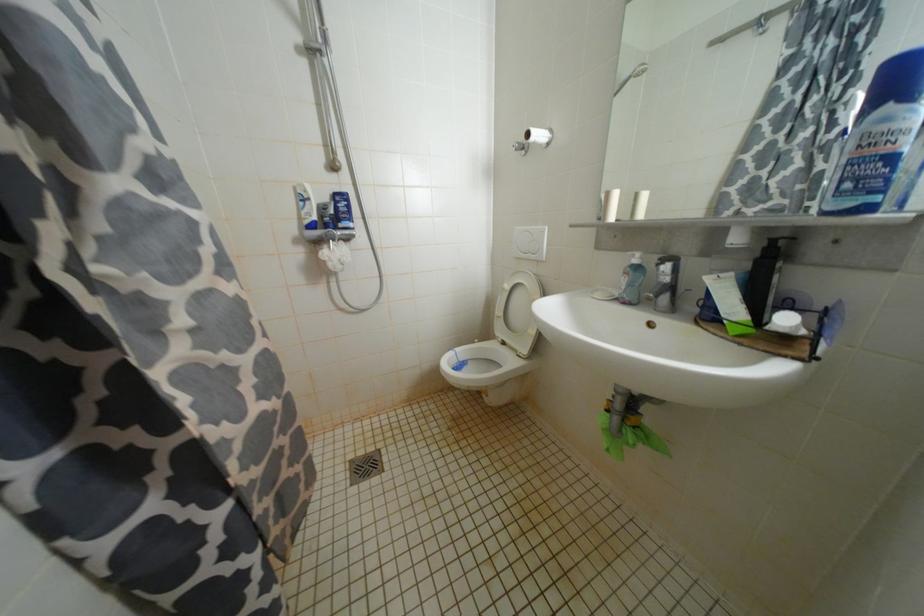
What are the coordinates of `cardboard toilet roll` in the screenshot? It's located at (610, 205).